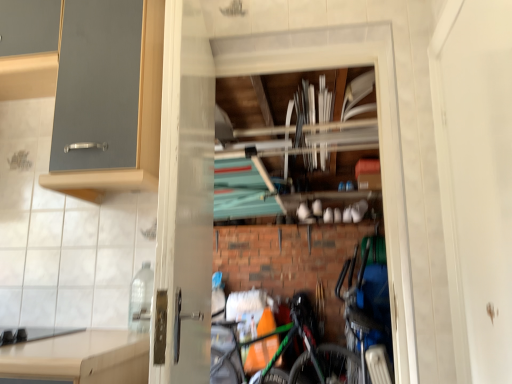
Question: Looking at their shapes, would you say black matte gas stove at lower left is wider or thinner than white matte screen door at right, which ranks as the second screen door in left-to-right order?

Choices:
 (A) thin
 (B) wide

Answer: (B)

Question: From a real-world perspective, relative to white matte screen door at right, which ranks as the second screen door in left-to-right order, is black matte gas stove at lower left vertically above or below?

Choices:
 (A) above
 (B) below

Answer: (B)

Question: Estimate the real-world distances between objects in this image. Which object is farther from the matte gray cabinet at upper left?

Choices:
 (A) clear plastic bottle at lower left
 (B) white matte screen door at right, the 1th screen door positioned from the right
 (C) blue metallic bicycle at lower right, positioned as the second bicycle in left-to-right order
 (D) green matte bicycle at center, which is the second bicycle from back to front
 (E) transparent glass screen door at center, the second screen door from the right

Answer: (D)

Question: Considering the real-world distances, which object is farthest from the green matte bicycle at center, which is the first bicycle from left to right?

Choices:
 (A) black matte gas stove at lower left
 (B) blue metallic bicycle at lower right, the 1th bicycle in the back-to-front sequence
 (C) clear plastic bottle at lower left
 (D) white matte screen door at right, which ranks as the second screen door in left-to-right order
 (E) transparent glass screen door at center, which is counted as the first screen door, starting from the left

Answer: (D)